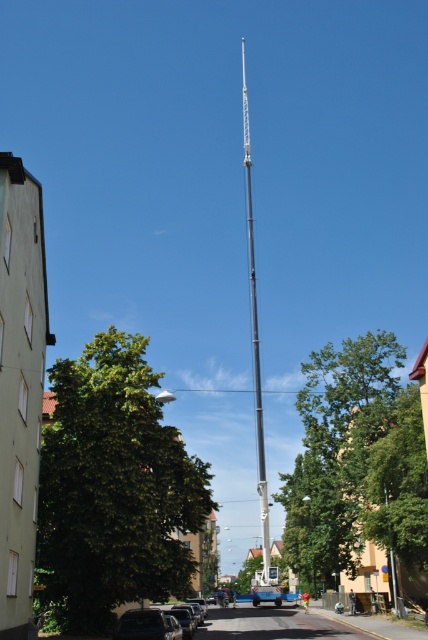
Question: Is green concrete building at left to the left of metallic gray mast at center from the viewer's perspective?

Choices:
 (A) no
 (B) yes

Answer: (B)

Question: Is green concrete building at left wider than metallic gray mast at center?

Choices:
 (A) no
 (B) yes

Answer: (A)

Question: Which object is positioned farthest from the green concrete building at left?

Choices:
 (A) metallic gray mast at center
 (B) shiny silver car at lower left

Answer: (A)

Question: Is metallic gray mast at center below shiny silver car at lower left?

Choices:
 (A) no
 (B) yes

Answer: (A)

Question: Which object is positioned farthest from the metallic gray mast at center?

Choices:
 (A) shiny silver car at lower left
 (B) green concrete building at left

Answer: (A)

Question: Estimate the real-world distances between objects in this image. Which object is farther from the shiny silver car at lower left?

Choices:
 (A) metallic gray mast at center
 (B) green concrete building at left

Answer: (A)